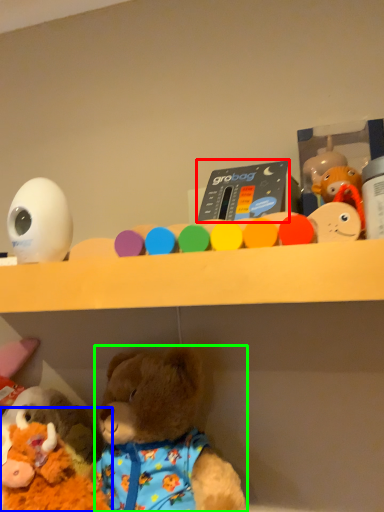
Question: Which object is the farthest from toy (highlighted by a red box)? Choose among these: toy (highlighted by a blue box) or teddy bear (highlighted by a green box).

Choices:
 (A) toy
 (B) teddy bear

Answer: (A)